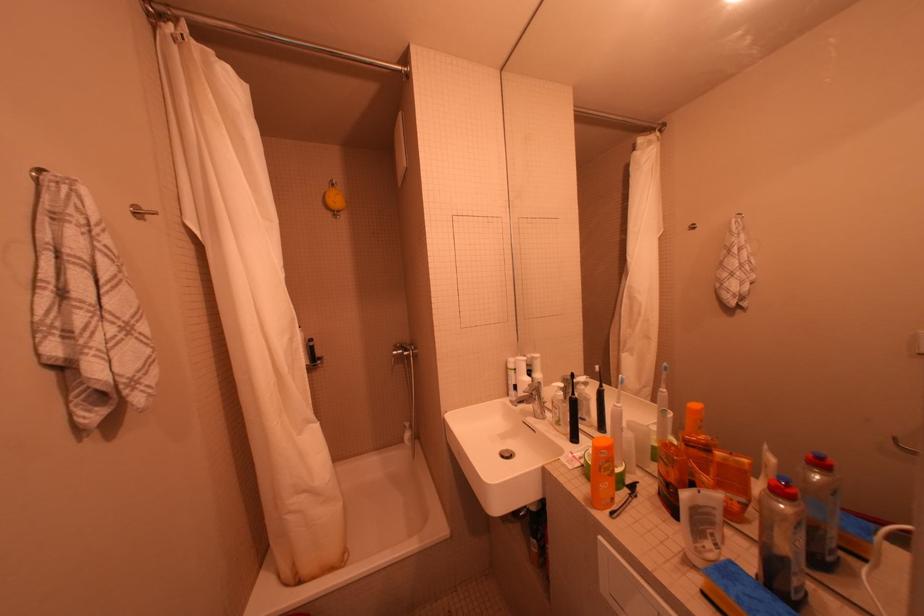
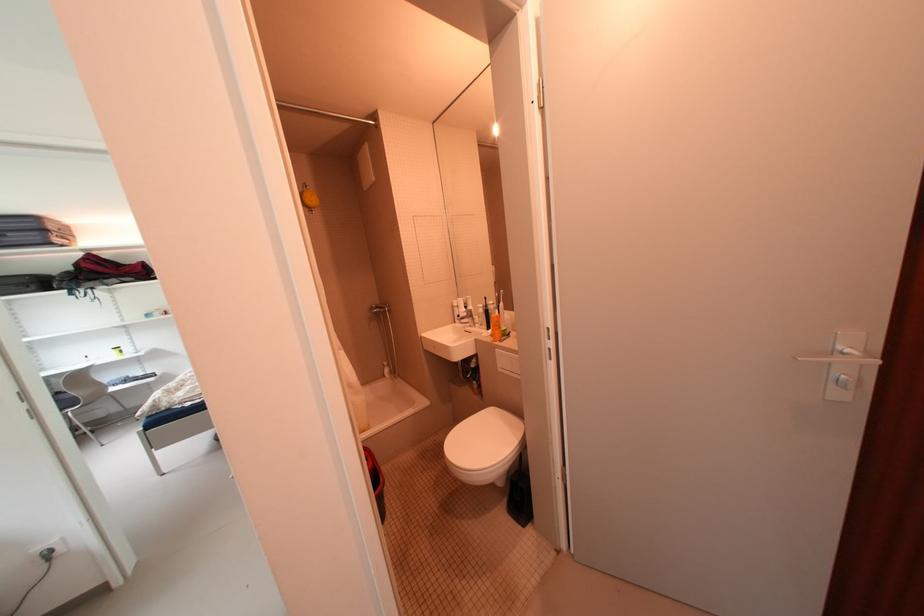
In the second image, find the point that corresponds to pixel 566 429 in the first image.

(490, 328)